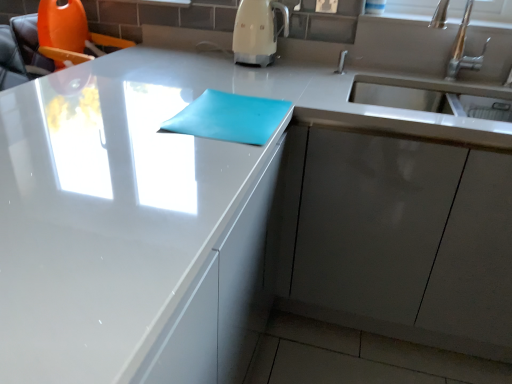
Question: From a real-world perspective, is matte gray cabinet at lower right positioned under white glossy coffee machine at upper center based on gravity?

Choices:
 (A) no
 (B) yes

Answer: (B)

Question: Considering the relative sizes of matte gray cabinet at lower right and white glossy coffee machine at upper center in the image provided, is matte gray cabinet at lower right shorter than white glossy coffee machine at upper center?

Choices:
 (A) yes
 (B) no

Answer: (B)

Question: Is matte gray cabinet at lower right bigger than white glossy coffee machine at upper center?

Choices:
 (A) yes
 (B) no

Answer: (A)

Question: Are matte gray cabinet at lower right and white glossy coffee machine at upper center far apart?

Choices:
 (A) no
 (B) yes

Answer: (A)

Question: Is matte gray cabinet at lower right positioned with its back to white glossy coffee machine at upper center?

Choices:
 (A) yes
 (B) no

Answer: (B)

Question: Is matte gray cabinet at lower right completely or partially outside of white glossy coffee machine at upper center?

Choices:
 (A) yes
 (B) no

Answer: (A)

Question: Is white glossy coffee machine at upper center not inside matte gray cabinet at lower right?

Choices:
 (A) no
 (B) yes

Answer: (B)

Question: Does white glossy coffee machine at upper center turn towards matte gray cabinet at lower right?

Choices:
 (A) yes
 (B) no

Answer: (B)

Question: Does white glossy coffee machine at upper center have a greater height compared to matte gray cabinet at lower right?

Choices:
 (A) yes
 (B) no

Answer: (B)

Question: Considering the relative sizes of white glossy coffee machine at upper center and matte gray cabinet at lower right in the image provided, is white glossy coffee machine at upper center bigger than matte gray cabinet at lower right?

Choices:
 (A) yes
 (B) no

Answer: (B)

Question: From the image's perspective, is white glossy coffee machine at upper center located beneath matte gray cabinet at lower right?

Choices:
 (A) yes
 (B) no

Answer: (B)

Question: Is matte gray cabinet at lower right completely or partially inside white glossy coffee machine at upper center?

Choices:
 (A) yes
 (B) no

Answer: (B)

Question: Is matte blue notepad at center bigger than white glossy coffee machine at upper center?

Choices:
 (A) yes
 (B) no

Answer: (B)